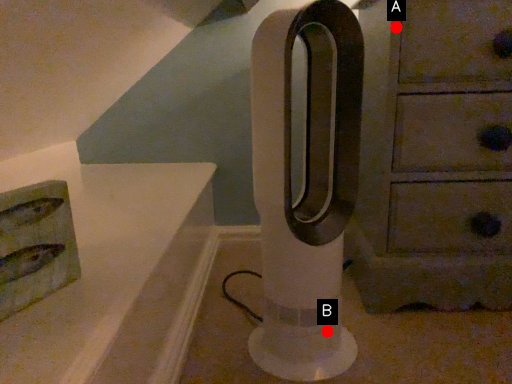
Question: Two points are circled on the image, labeled by A and B beside each circle. Which point is closer to the camera?

Choices:
 (A) A is closer
 (B) B is closer

Answer: (B)